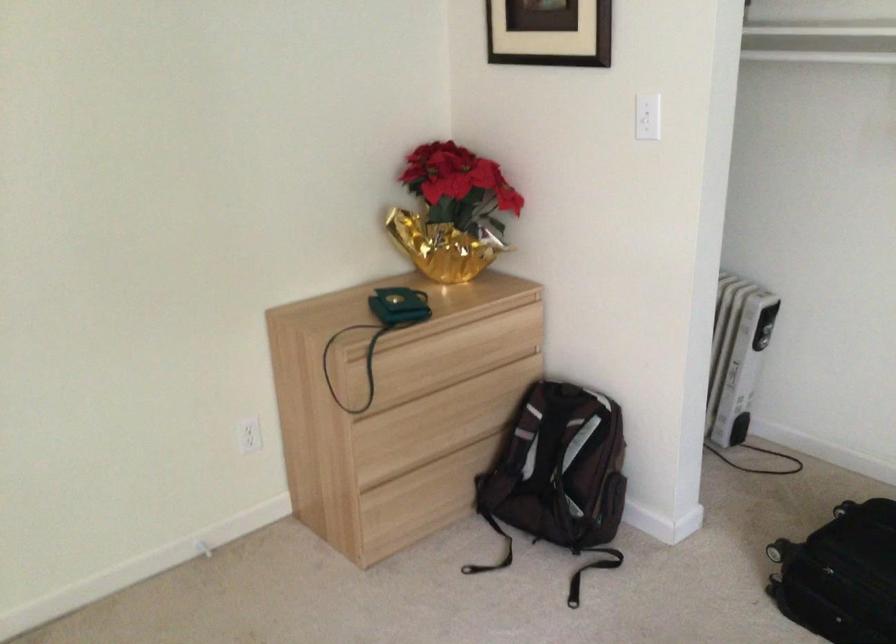
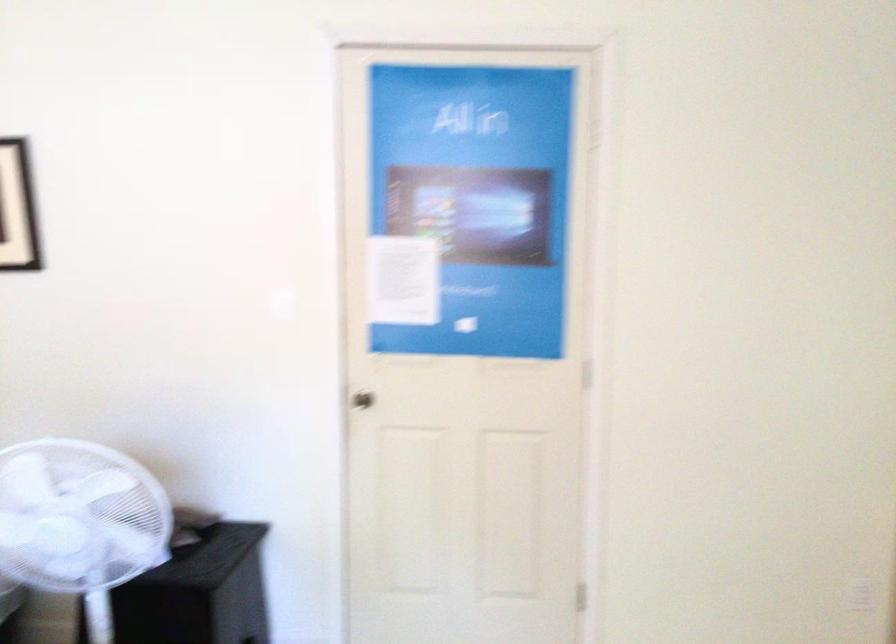
Question: The camera is either moving clockwise (left) or counter-clockwise (right) around the object. The first image is from the beginning of the video and the second image is from the end. Is the camera moving left or right when shooting the video?

Choices:
 (A) Left
 (B) Right

Answer: (B)